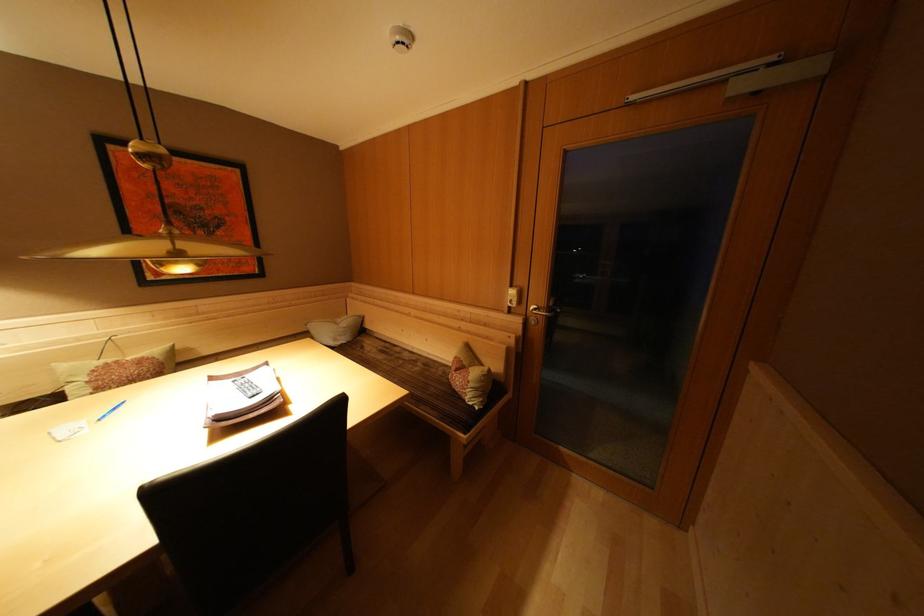
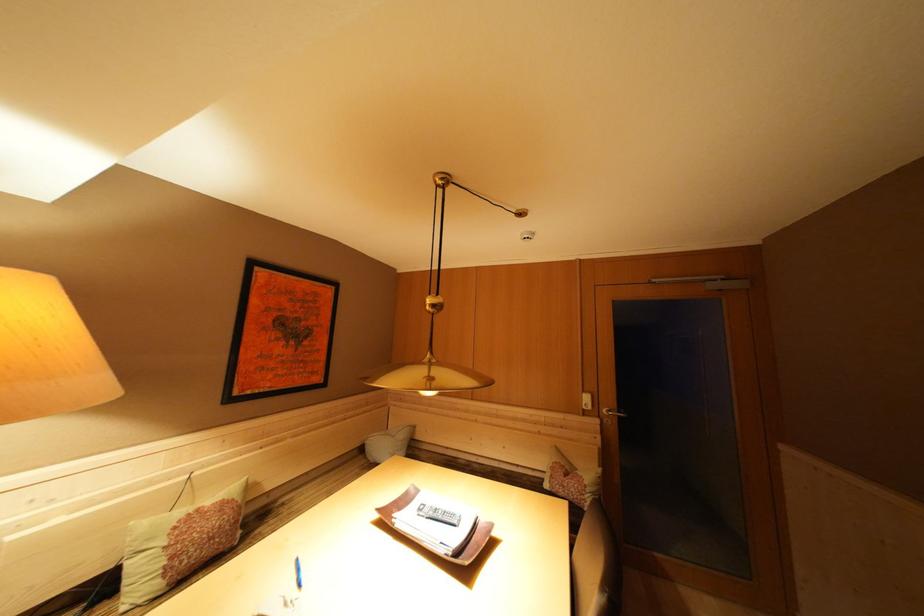
The point at (x=351, y=329) is marked in the first image. Where is the corresponding point in the second image?

(408, 440)